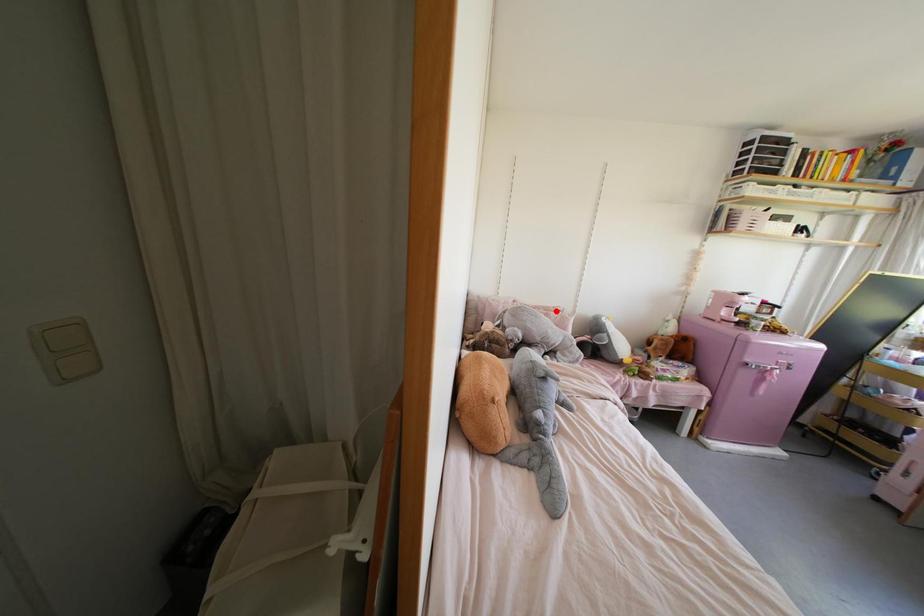
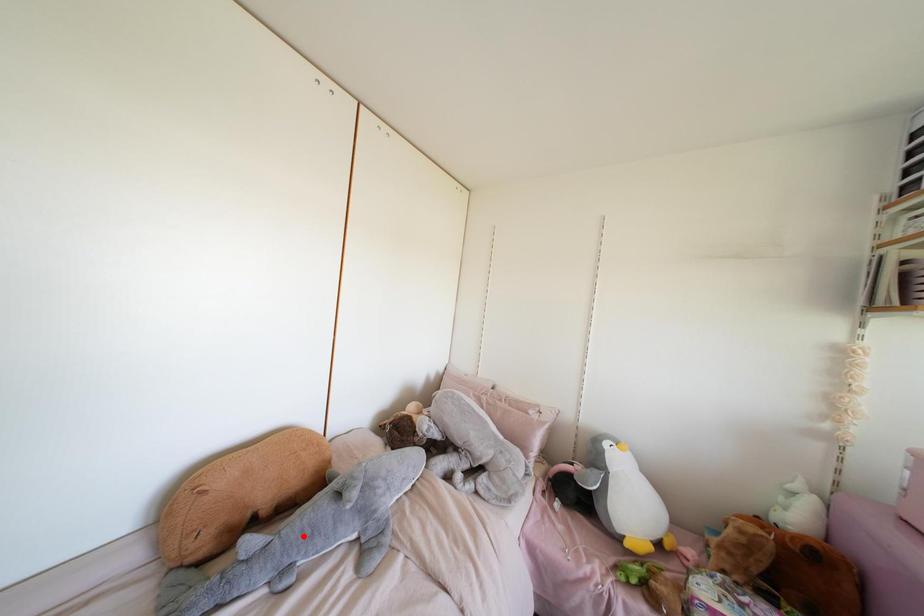
I am providing you with two images of the same scene from different viewpoints. A red point is marked on the first image and another point is marked on the second image. Do the highlighted points in image1 and image2 indicate the same real-world spot?

No